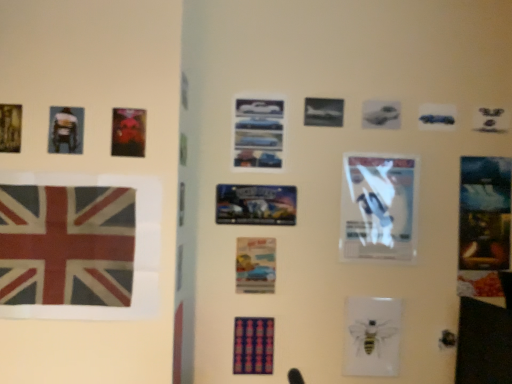
Question: Considering the relative sizes of textured fabric flag at left and metallic blue cars at center, which appears as the 6th poster when ordered from the bottom, in the image provided, is textured fabric flag at left taller than metallic blue cars at center, which appears as the 6th poster when ordered from the bottom,?

Choices:
 (A) yes
 (B) no

Answer: (A)

Question: Is textured fabric flag at left at the left side of metallic blue cars at center, the 1th poster viewed from the top?

Choices:
 (A) yes
 (B) no

Answer: (A)

Question: Is textured fabric flag at left aimed at metallic blue cars at center, which is the 6th poster in left-to-right order?

Choices:
 (A) yes
 (B) no

Answer: (B)

Question: Is textured fabric flag at left bigger than metallic blue cars at center, the 1th poster viewed from the right?

Choices:
 (A) yes
 (B) no

Answer: (A)

Question: Does textured fabric flag at left have a greater width compared to metallic blue cars at center, the 1th poster viewed from the right?

Choices:
 (A) yes
 (B) no

Answer: (A)

Question: In terms of size, does metallic silver poster at center, which is the fourth poster from top to bottom, appear bigger or smaller than dark blue fabric poster at center, which ranks as the fourth poster in front-to-back order?

Choices:
 (A) big
 (B) small

Answer: (A)

Question: Is metallic silver poster at center, arranged as the 2th poster when viewed from the right, wider or thinner than dark blue fabric poster at center, which ranks as the fourth poster in front-to-back order?

Choices:
 (A) thin
 (B) wide

Answer: (A)

Question: Is metallic silver poster at center, which appears as the 4th poster when viewed from the back, inside the boundaries of dark blue fabric poster at center, marked as the fourth poster in a right-to-left arrangement, or outside?

Choices:
 (A) inside
 (B) outside

Answer: (B)

Question: From the image's perspective, is metallic silver poster at center, which appears as the 4th poster when viewed from the back, located above or below dark blue fabric poster at center, marked as the fourth poster in a right-to-left arrangement?

Choices:
 (A) below
 (B) above

Answer: (B)

Question: Is watercolor paper poster at center, positioned as the 1th poster in back-to-front order, spatially inside textured fabric flag at left, or outside of it?

Choices:
 (A) outside
 (B) inside

Answer: (A)

Question: Looking at their shapes, would you say watercolor paper poster at center, which is the sixth poster from front to back, is wider or thinner than textured fabric flag at left?

Choices:
 (A) thin
 (B) wide

Answer: (A)

Question: Does point (261, 268) appear closer or farther from the camera than point (86, 203)?

Choices:
 (A) farther
 (B) closer

Answer: (A)

Question: From a real-world perspective, relative to textured fabric flag at left, is watercolor paper poster at center, which is counted as the 4th poster, starting from the left, vertically above or below?

Choices:
 (A) below
 (B) above

Answer: (A)

Question: Considering their positions, is metallic silver poster at center, which is the fourth poster from top to bottom, located in front of or behind textured fabric flag at left?

Choices:
 (A) behind
 (B) front

Answer: (A)

Question: Considering the positions of point (265, 215) and point (72, 218), is point (265, 215) closer or farther from the camera than point (72, 218)?

Choices:
 (A) farther
 (B) closer

Answer: (A)